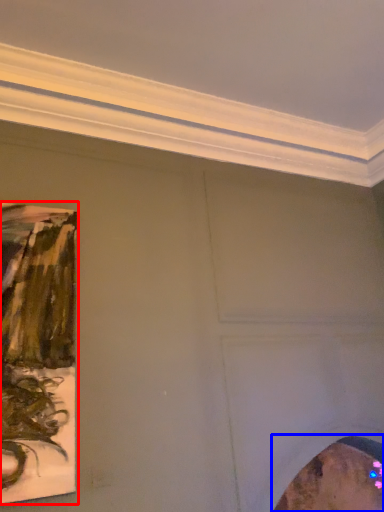
Question: Among these objects, which one is farthest to the camera, picture frame (highlighted by a red box) or picture frame (highlighted by a blue box)?

Choices:
 (A) picture frame
 (B) picture frame

Answer: (B)